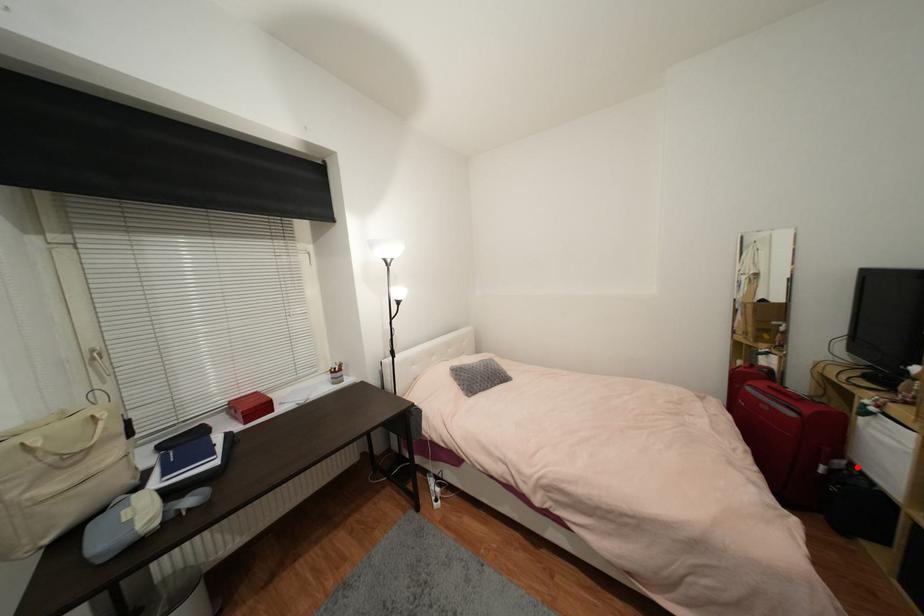
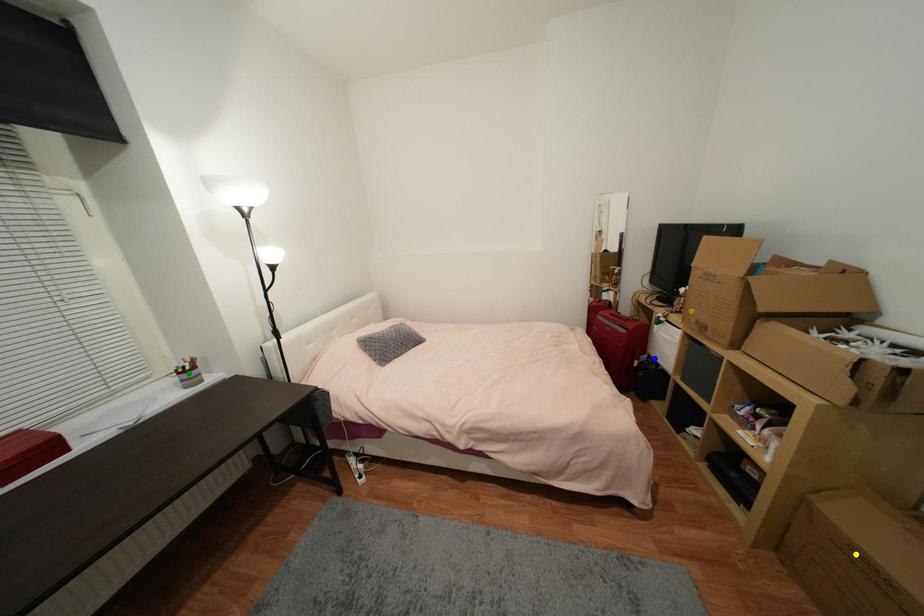
Question: I am providing you with two images of the same scene from different viewpoints. A red point is marked on the first image. You are given multiple points on the second image. In image 2, which mark is for the same physical point as the one in image 1?

Choices:
 (A) green point
 (B) blue point
 (C) yellow point

Answer: (B)